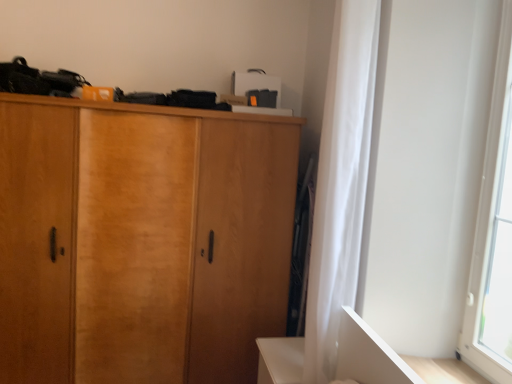
Question: Is wooden cabinet at center far from white sheer curtain at right?

Choices:
 (A) yes
 (B) no

Answer: (B)

Question: From a real-world perspective, is wooden cabinet at center over white sheer curtain at right?

Choices:
 (A) no
 (B) yes

Answer: (A)

Question: Is wooden cabinet at center completely or partially outside of white sheer curtain at right?

Choices:
 (A) yes
 (B) no

Answer: (A)

Question: Is wooden cabinet at center looking in the opposite direction of white sheer curtain at right?

Choices:
 (A) no
 (B) yes

Answer: (A)

Question: Can you confirm if wooden cabinet at center is taller than white sheer curtain at right?

Choices:
 (A) yes
 (B) no

Answer: (A)

Question: In the image, is wooden cabinet at center positioned in front of or behind transparent glass window at right?

Choices:
 (A) behind
 (B) front

Answer: (A)

Question: In the image, is wooden cabinet at center on the left side or the right side of transparent glass window at right?

Choices:
 (A) left
 (B) right

Answer: (A)

Question: From a real-world perspective, relative to transparent glass window at right, is wooden cabinet at center vertically above or below?

Choices:
 (A) below
 (B) above

Answer: (A)

Question: Is wooden cabinet at center bigger or smaller than transparent glass window at right?

Choices:
 (A) small
 (B) big

Answer: (B)

Question: From the image's perspective, is wooden cabinet at center located above or below white sheer curtain at right?

Choices:
 (A) above
 (B) below

Answer: (B)

Question: Is wooden cabinet at center wider or thinner than white sheer curtain at right?

Choices:
 (A) thin
 (B) wide

Answer: (B)

Question: In terms of height, does wooden cabinet at center look taller or shorter compared to white sheer curtain at right?

Choices:
 (A) short
 (B) tall

Answer: (B)

Question: Is point [x=37, y=102] closer or farther from the camera than point [x=328, y=347]?

Choices:
 (A) farther
 (B) closer

Answer: (A)

Question: Is transparent glass window at right inside the boundaries of white sheer curtain at right, or outside?

Choices:
 (A) outside
 (B) inside

Answer: (A)

Question: Based on their sizes in the image, would you say transparent glass window at right is bigger or smaller than white sheer curtain at right?

Choices:
 (A) small
 (B) big

Answer: (A)